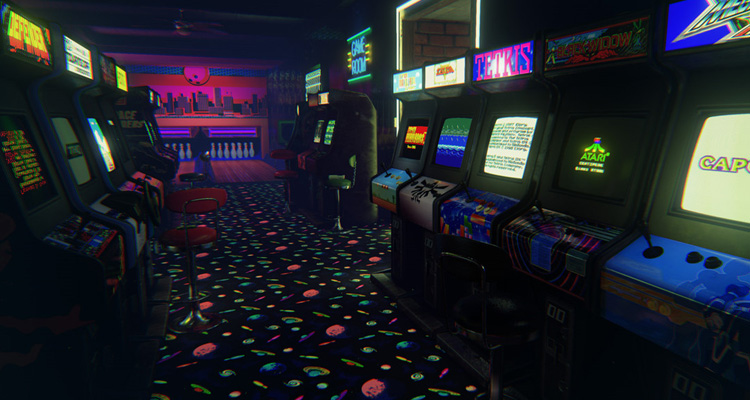
Where is `brick wall`? This screenshot has width=750, height=400. brick wall is located at coordinates (441, 44), (438, 30).